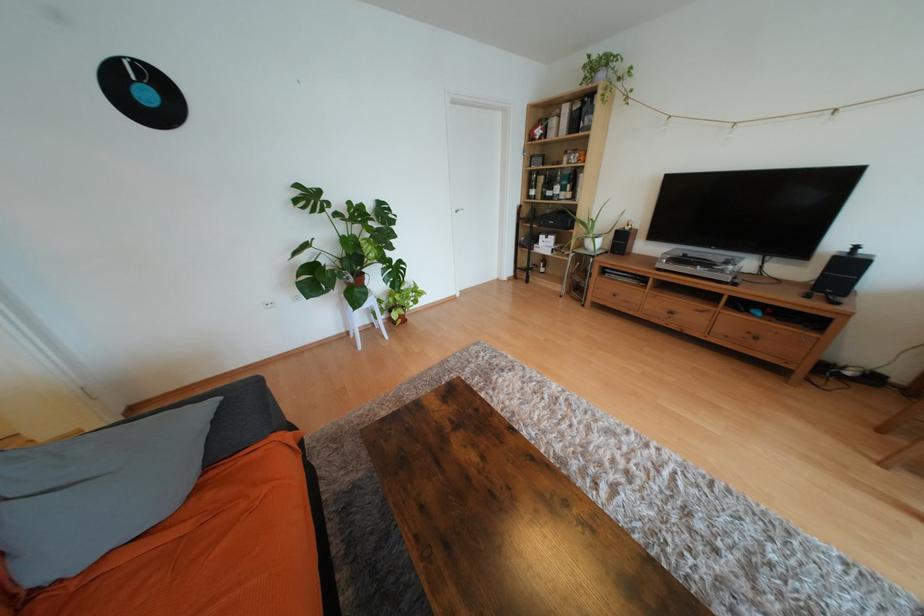
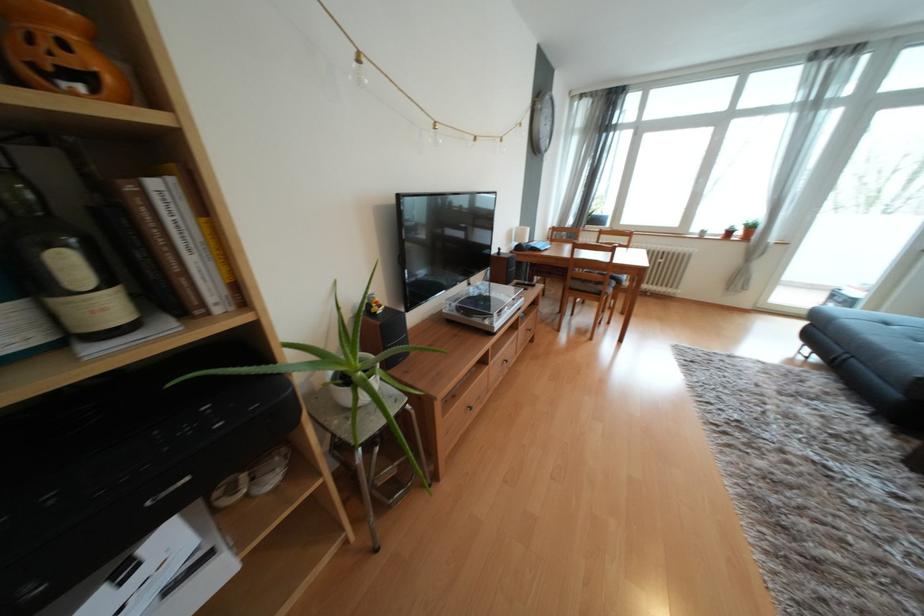
Where in the second image is the point corresponding to pixel 588 160 from the first image?

(104, 68)